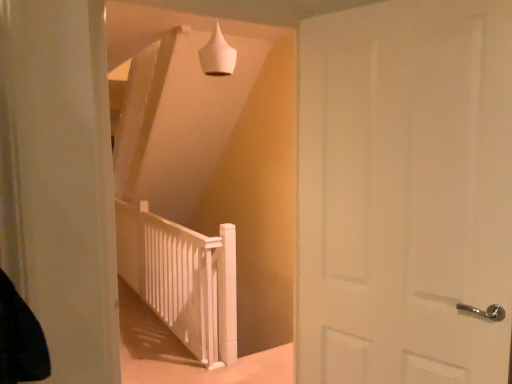
Question: Relative to white matte rail at center, is white matte door at center in front or behind?

Choices:
 (A) behind
 (B) front

Answer: (B)

Question: From the image's perspective, is white matte door at center above or below white matte rail at center?

Choices:
 (A) above
 (B) below

Answer: (A)

Question: Estimate the real-world distances between objects in this image. Which object is farther from the white matte cone at upper center?

Choices:
 (A) white matte door at center
 (B) white matte rail at center

Answer: (B)

Question: Which object is positioned closest to the white matte door at center?

Choices:
 (A) white matte cone at upper center
 (B) white matte rail at center

Answer: (A)